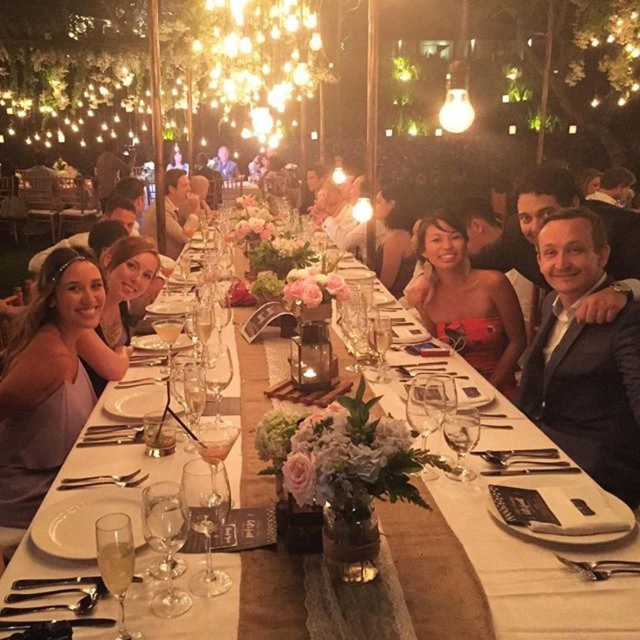
You are a photographer at the wedding reception. You need to capture a photo that includes both the matte purple dress at left and the matte red dress at center. Since the camera has a limited focus range, which dress should you position closer to the camera to ensure both are in focus?

The matte purple dress at left has a lesser width compared to the matte red dress at center, so positioning the matte purple dress at left closer to the camera would help ensure both dresses are within the focus range.

You are a photographer at the wedding reception. You need to capture a photo of both the matte purple dress at left and the matte red dress at center. Which dress is closer to the left side of the frame?

The matte purple dress at left is positioned on the left side of the matte red dress at center, so it is closer to the left side of the frame.